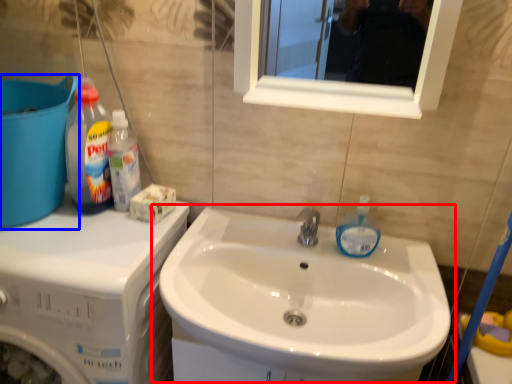
Question: Among these objects, which one is farthest to the camera, sink (highlighted by a red box) or water tank (highlighted by a blue box)?

Choices:
 (A) sink
 (B) water tank

Answer: (B)